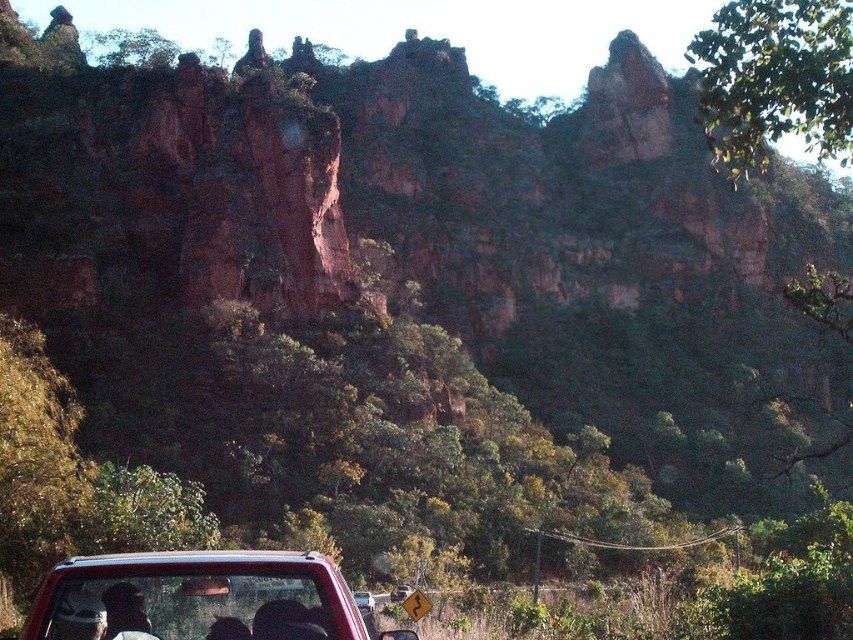
You are a passenger in the matte red truck at lower center. You notice dark hair at lower center in your line of sight. Based on the scene, where is the dark hair located relative to the truck?

The dark hair at lower center is below the matte red truck at lower center because the truck is positioned above it.

You are a passenger in the matte red truck at lower center. You notice someone with dark hair at lower center through the rear window. Can you see their face clearly?

The matte red truck at lower center is in front of dark hair at lower center, so the truck is blocking your view of their face.

You are a hiker planning to drive up the mountain road. You see the matte red truck at lower center and the metallic red car at lower center parked on the road. Which vehicle would you need to avoid if there is a low clearance bridge ahead?

You should avoid the metallic red car at lower center because the matte red truck at lower center is not as tall as metallic red car at lower center, meaning the car is taller and more likely to hit the bridge.